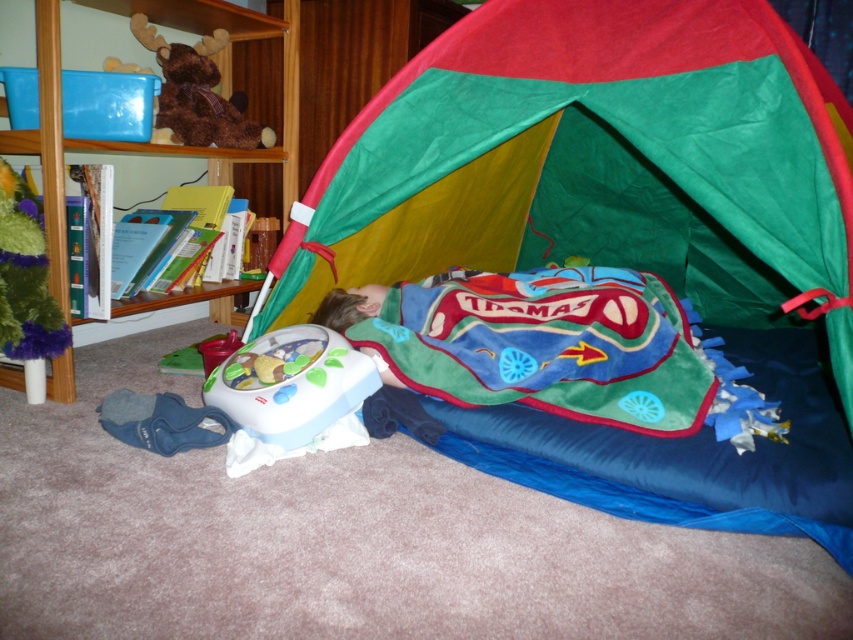
Who is shorter, multicolored fabric tent at center or thomas-patterned fleece blanket at center?

thomas-patterned fleece blanket at center is shorter.

The width and height of the screenshot is (853, 640). What do you see at coordinates (604, 244) in the screenshot?
I see `multicolored fabric tent at center` at bounding box center [604, 244].

This screenshot has width=853, height=640. I want to click on multicolored fabric tent at center, so click(x=604, y=244).

In the scene shown: Is fuzzy green plush at upper left to the right of brown plush bear at upper left from the viewer's perspective?

No, fuzzy green plush at upper left is not to the right of brown plush bear at upper left.

Does point (15, 193) come behind point (245, 120)?

No, (15, 193) is in front of (245, 120).

Identify the location of fuzzy green plush at upper left. (25, 276).

Consider the image. Is multicolored fabric tent at center to the right of brown plush bear at upper left from the viewer's perspective?

Yes, multicolored fabric tent at center is to the right of brown plush bear at upper left.

Image resolution: width=853 pixels, height=640 pixels. In order to click on multicolored fabric tent at center in this screenshot , I will do `click(604, 244)`.

Where is `multicolored fabric tent at center`? The height and width of the screenshot is (640, 853). multicolored fabric tent at center is located at coordinates (604, 244).